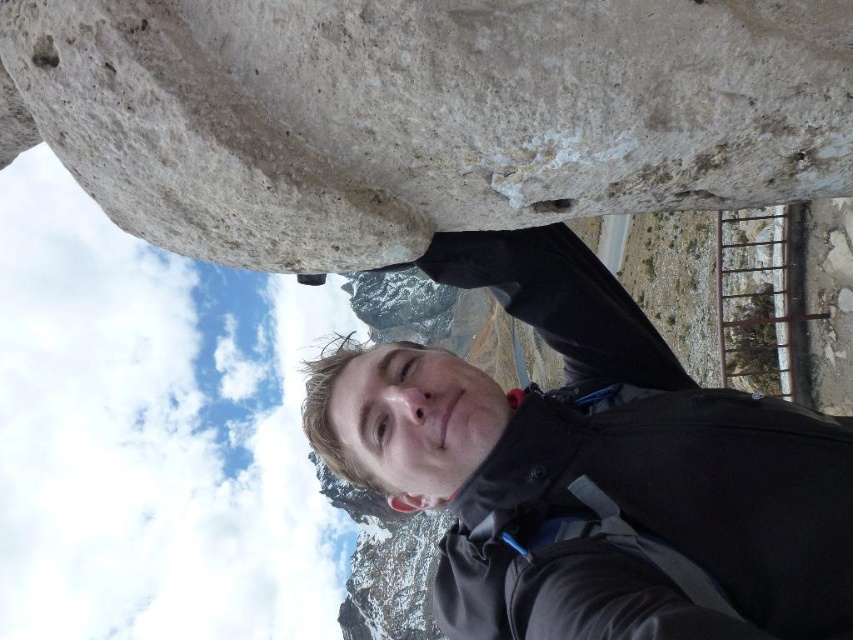
Is white rough stone at upper center to the left of black matte jacket at center from the viewer's perspective?

Indeed, white rough stone at upper center is positioned on the left side of black matte jacket at center.

Which of these two, white rough stone at upper center or black matte jacket at center, stands taller?

Standing taller between the two is black matte jacket at center.

Is point (511, 102) positioned behind point (822, 524)?

No, it is not.

The height and width of the screenshot is (640, 853). I want to click on white rough stone at upper center, so click(x=426, y=115).